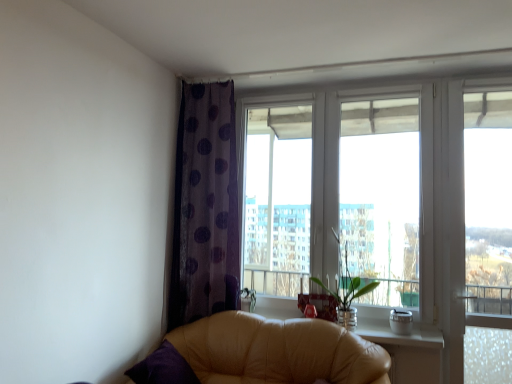
Question: Is purple dotted curtain at left taller than transparent plastic screen at right?

Choices:
 (A) yes
 (B) no

Answer: (B)

Question: Is transparent plastic screen at right surrounded by purple dotted curtain at left?

Choices:
 (A) no
 (B) yes

Answer: (A)

Question: Are purple dotted curtain at left and transparent plastic screen at right far apart?

Choices:
 (A) no
 (B) yes

Answer: (B)

Question: Would you say purple dotted curtain at left is outside transparent plastic screen at right?

Choices:
 (A) yes
 (B) no

Answer: (A)

Question: Does purple dotted curtain at left have a lesser width compared to transparent plastic screen at right?

Choices:
 (A) yes
 (B) no

Answer: (B)

Question: Is purple dotted curtain at left spatially inside transparent plastic screen at right, or outside of it?

Choices:
 (A) outside
 (B) inside

Answer: (A)

Question: Considering the relative positions of purple dotted curtain at left and transparent plastic screen at right in the image provided, is purple dotted curtain at left to the left or to the right of transparent plastic screen at right?

Choices:
 (A) right
 (B) left

Answer: (B)

Question: From a real-world perspective, is purple dotted curtain at left physically located above or below transparent plastic screen at right?

Choices:
 (A) above
 (B) below

Answer: (A)

Question: Is purple dotted curtain at left wider or thinner than transparent plastic screen at right?

Choices:
 (A) thin
 (B) wide

Answer: (B)

Question: Relative to purple dotted curtain at left, is green glass vase at center in front or behind?

Choices:
 (A) behind
 (B) front

Answer: (B)

Question: Is point (331, 228) positioned closer to the camera than point (217, 256)?

Choices:
 (A) farther
 (B) closer

Answer: (A)

Question: Would you say green glass vase at center is inside or outside purple dotted curtain at left?

Choices:
 (A) outside
 (B) inside

Answer: (A)

Question: From their relative heights in the image, would you say green glass vase at center is taller or shorter than purple dotted curtain at left?

Choices:
 (A) short
 (B) tall

Answer: (A)

Question: Looking at the image, does purple dotted curtain at left seem bigger or smaller compared to leather couch at lower left?

Choices:
 (A) big
 (B) small

Answer: (B)

Question: Choose the correct answer: Is purple dotted curtain at left inside leather couch at lower left or outside it?

Choices:
 (A) inside
 (B) outside

Answer: (B)